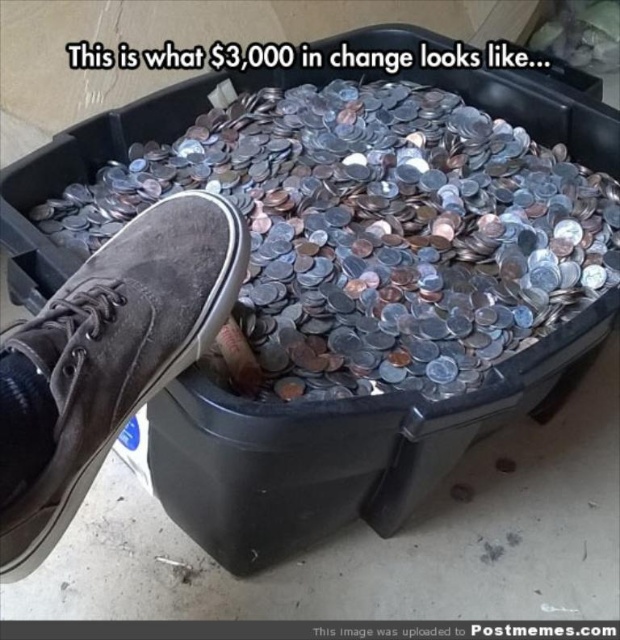
Does silver metallic coins at center appear on the left side of brown suede shoe at lower left?

No, silver metallic coins at center is not to the left of brown suede shoe at lower left.

Based on the photo, can you confirm if silver metallic coins at center is smaller than brown suede shoe at lower left?

Incorrect, silver metallic coins at center is not smaller in size than brown suede shoe at lower left.

Describe the element at coordinates (376, 230) in the screenshot. I see `silver metallic coins at center` at that location.

At what (x,y) coordinates should I click in order to perform the action: click on silver metallic coins at center. Please return your answer as a coordinate pair (x, y). The height and width of the screenshot is (640, 620). Looking at the image, I should click on (376, 230).